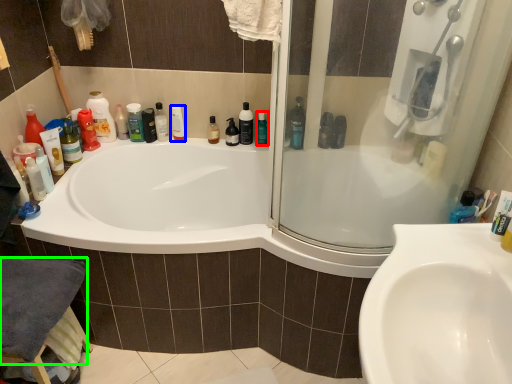
Question: Considering the real-world distances, which object is farthest from mouthwash (highlighted by a red box)? mouthwash (highlighted by a blue box) or bath towel (highlighted by a green box)?

Choices:
 (A) mouthwash
 (B) bath towel

Answer: (B)